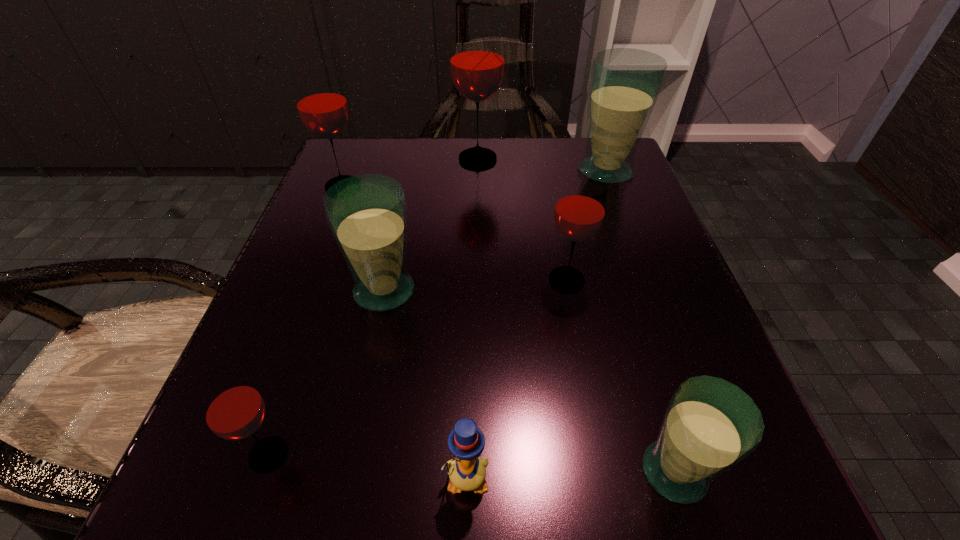
Where is `object that stands as the third closest to the third nearest red glass`? This screenshot has width=960, height=540. object that stands as the third closest to the third nearest red glass is located at coordinates (579, 213).

Point out which glass is positioned as the fifth nearest to the third biggest red glass. Please provide its 2D coordinates. Your answer should be formatted as a tuple, i.e. [(x, y)], where the tuple contains the x and y coordinates of a point satisfying the conditions above.

[(320, 99)]

The width and height of the screenshot is (960, 540). I want to click on glass that is the fifth closest to the yellow duckling, so click(x=320, y=99).

Identify which red glass is located as the third nearest to the third glass from left to right. Please provide its 2D coordinates. Your answer should be formatted as a tuple, i.e. [(x, y)], where the tuple contains the x and y coordinates of a point satisfying the conditions above.

[(579, 213)]

In order to click on red glass that stands as the second closest to the second smallest red glass in this screenshot , I will do `click(320, 99)`.

Image resolution: width=960 pixels, height=540 pixels. I want to click on blue glass that is the nearest to the third nearest red glass, so click(367, 214).

This screenshot has height=540, width=960. I want to click on blue glass that can be found as the closest to the third smallest red glass, so click(x=367, y=214).

Find the location of a particular element. This screenshot has width=960, height=540. free space that satisfies the following two spatial constraints: 1. on the front side of the smallest blue glass; 2. on the right side of the second farthest red glass is located at coordinates (231, 472).